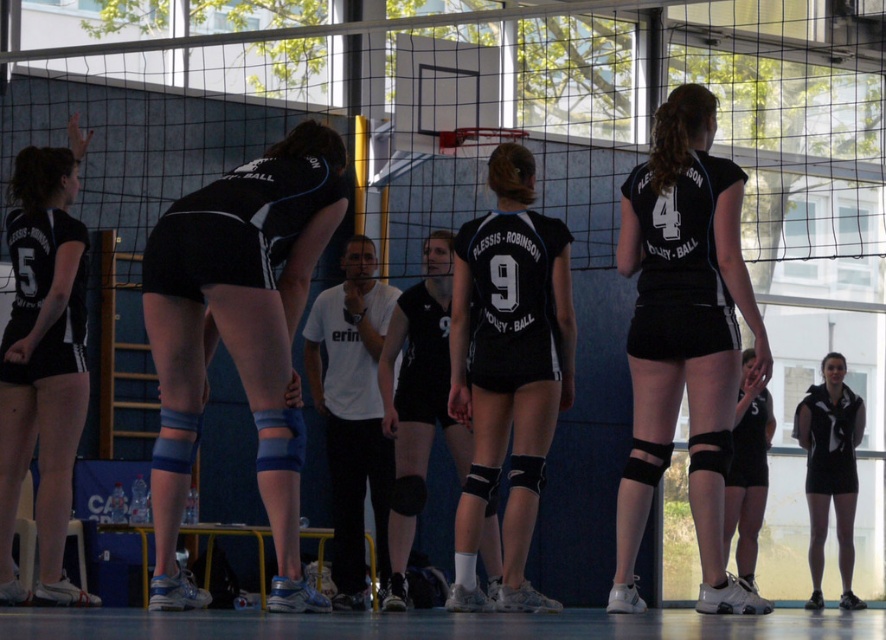
Which is behind, point (309, 244) or point (755, 410)?

Point (755, 410)

Is point (226, 252) positioned after point (759, 474)?

No, (226, 252) is closer to viewer.

Is point (284, 218) farther from viewer compared to point (745, 506)?

No, (284, 218) is in front of (745, 506).

What are the coordinates of `matte black shorts at center` in the screenshot? It's located at (238, 336).

Is matte black shorts at center wider than matte black shorts at left?

Indeed, matte black shorts at center has a greater width compared to matte black shorts at left.

Between point (247, 326) and point (5, 576), which one is positioned behind?

The point (5, 576) is more distant.

Find the location of a particular element. matte black shorts at center is located at coordinates (238, 336).

Between matte black volleyball uniform at center and matte black shorts at lower right, which one has less height?

matte black shorts at lower right is shorter.

What are the coordinates of `matte black volleyball uniform at center` in the screenshot? It's located at (682, 337).

You are a GUI agent. You are given a task and a screenshot of the screen. Output one action in this format:
    pyautogui.click(x=<x>, y=<y>)
    Task: Click on the matte black volleyball uniform at center
    The image size is (886, 640).
    Given the screenshot: What is the action you would take?
    pyautogui.click(x=682, y=337)